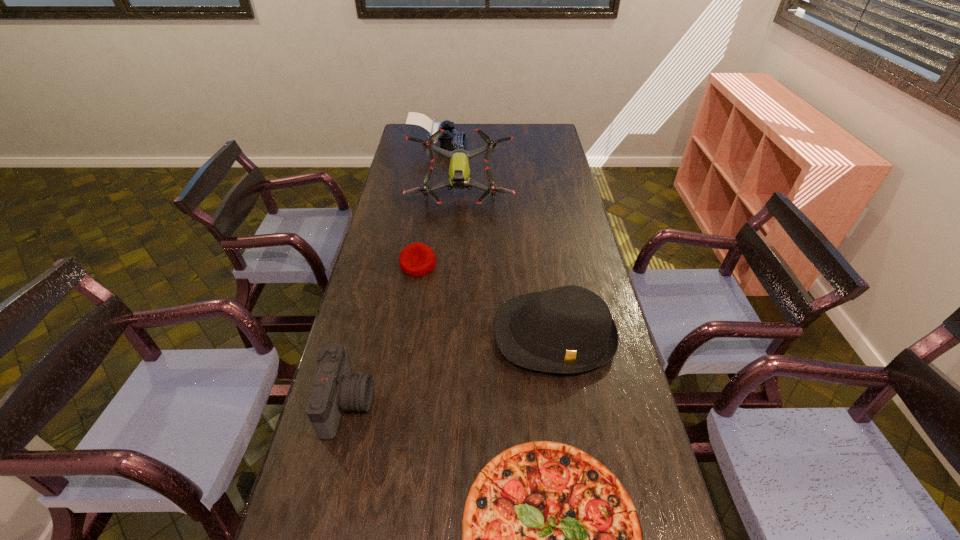
This screenshot has width=960, height=540. In order to click on vacant space at the left edge in this screenshot , I will do `click(405, 166)`.

In the image, there is a desktop. At what (x,y) coordinates should I click in order to perform the action: click on free region at the right edge. Please return your answer as a coordinate pair (x, y). The height and width of the screenshot is (540, 960). Looking at the image, I should click on (596, 410).

The image size is (960, 540). Identify the location of vacant space at the far right corner. (544, 138).

Locate an element on the screen. The image size is (960, 540). free space between the second shortest object and the second farthest object is located at coordinates (440, 230).

Where is `free space between the camera and the fedora`? The height and width of the screenshot is (540, 960). free space between the camera and the fedora is located at coordinates (451, 370).

Locate an element on the screen. This screenshot has height=540, width=960. vacant region between the second shortest object and the fedora is located at coordinates point(487,300).

Locate an element on the screen. vacant space that's between the fedora and the camera is located at coordinates (451, 370).

The height and width of the screenshot is (540, 960). I want to click on vacant area that lies between the tallest object and the fedora, so click(507, 265).

Image resolution: width=960 pixels, height=540 pixels. I want to click on vacant area that lies between the beanbag and the farthest object, so click(x=428, y=205).

Locate an element on the screen. The height and width of the screenshot is (540, 960). object that can be found as the third closest to the farthest object is located at coordinates (569, 329).